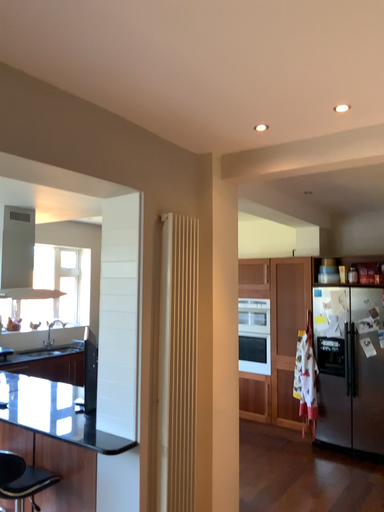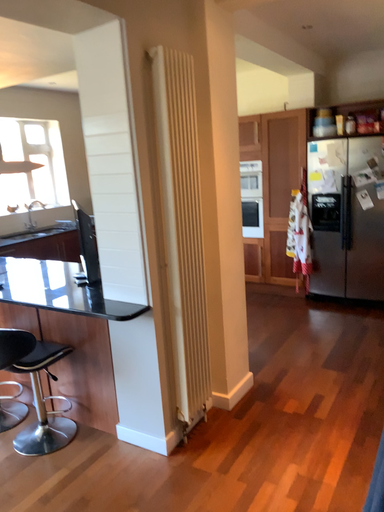
Question: Which way did the camera rotate in the video?

Choices:
 (A) rotated upward
 (B) rotated downward

Answer: (B)